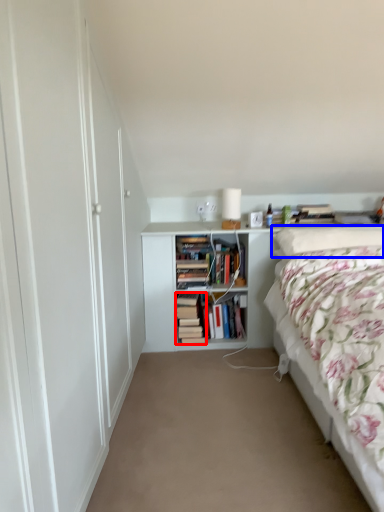
Question: Which object is further to the camera taking this photo, book (highlighted by a red box) or pillow (highlighted by a blue box)?

Choices:
 (A) book
 (B) pillow

Answer: (A)